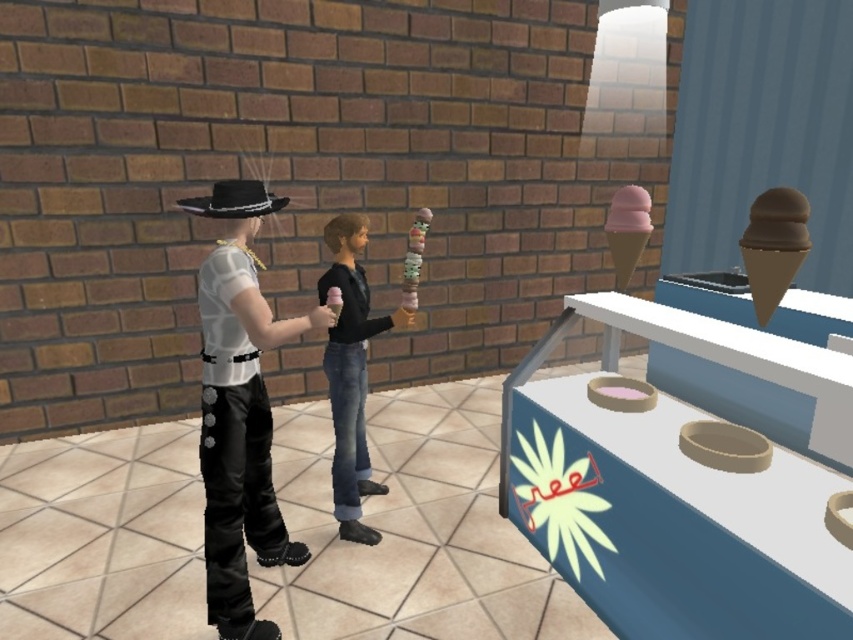
Question: Where is chocolate matte ice cream cone at upper right located in relation to pink matte ice cream cone at center in the image?

Choices:
 (A) below
 (B) above

Answer: (B)

Question: Can you confirm if leather pants at left is smaller than jeans at center?

Choices:
 (A) no
 (B) yes

Answer: (A)

Question: Which point is closer to the camera?

Choices:
 (A) (328, 300)
 (B) (250, 241)

Answer: (A)

Question: Is jeans at center below multicolored candy at center?

Choices:
 (A) no
 (B) yes

Answer: (B)

Question: Which object is the farthest from the pink matte ice cream cone at upper right?

Choices:
 (A) leather pants at left
 (B) jeans at center
 (C) chocolate matte ice cream cone at upper right

Answer: (B)

Question: Among these points, which one is farthest from the camera?

Choices:
 (A) (631, 246)
 (B) (410, 285)
 (C) (219, 376)
 (D) (776, 289)

Answer: (B)